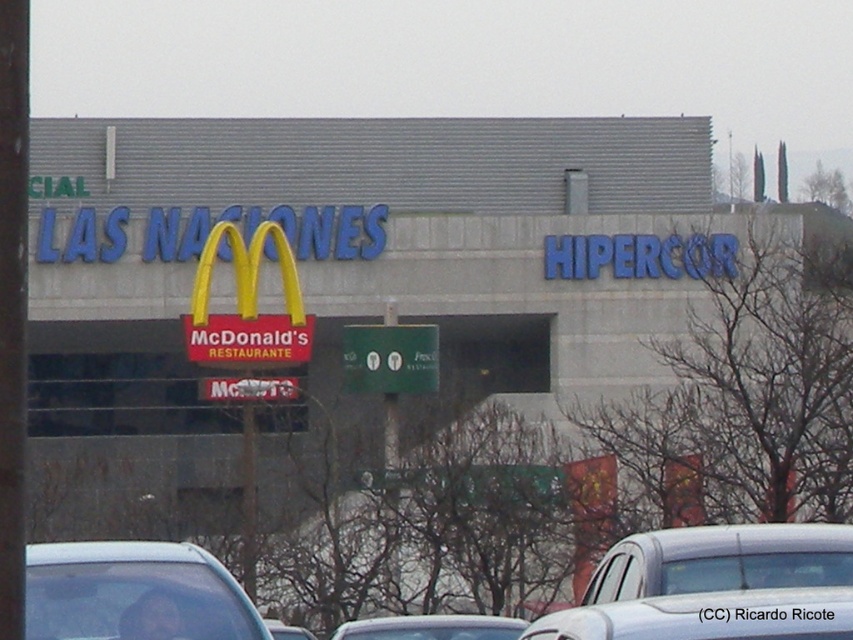
Question: Estimate the real-world distances between objects in this image. Which object is closer to the white matte car at lower center?

Choices:
 (A) white glossy car at center
 (B) silver metallic car at center
 (C) clear glass car at lower left

Answer: (A)

Question: Does clear glass car at lower left appear over green matte sign at center?

Choices:
 (A) no
 (B) yes

Answer: (A)

Question: Which is nearer to the white matte car at lower center?

Choices:
 (A) green matte sign at center
 (B) white glossy car at center

Answer: (B)

Question: Which object is the farthest from the green matte sign at center?

Choices:
 (A) white matte car at lower center
 (B) silver metallic car at center
 (C) clear glass car at lower left
 (D) white glossy car at center

Answer: (C)

Question: Can you confirm if white matte car at lower center is positioned to the right of silver metallic car at center?

Choices:
 (A) yes
 (B) no

Answer: (A)

Question: Is green matte sign at center smaller than silver metallic car at center?

Choices:
 (A) no
 (B) yes

Answer: (B)